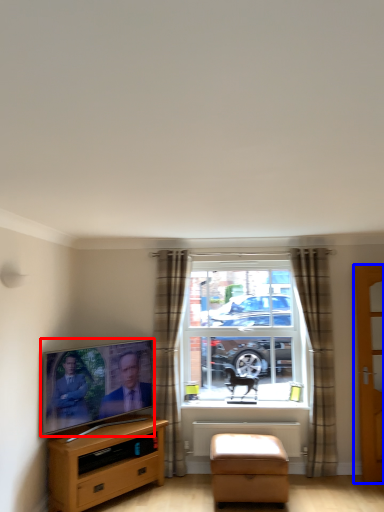
Question: Which object is closer to the camera taking this photo, television (highlighted by a red box) or door (highlighted by a blue box)?

Choices:
 (A) television
 (B) door

Answer: (A)